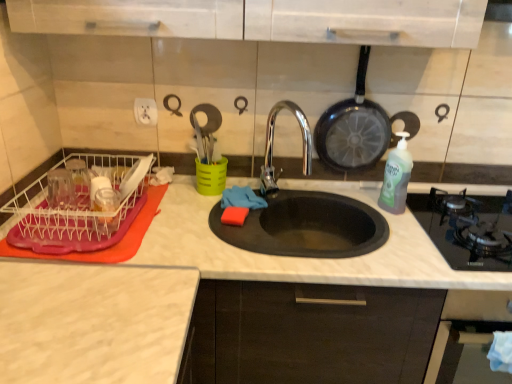
At what (x,y) coordinates should I click in order to perform the action: click on unoccupied space behind green translucent bottle at right. Please return your answer as a coordinate pair (x, y). Looking at the image, I should click on (362, 196).